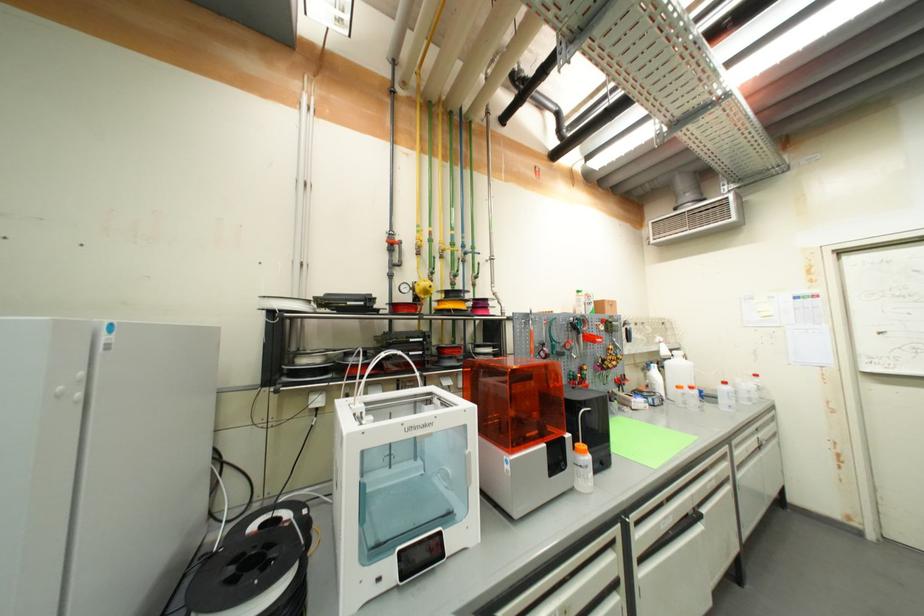
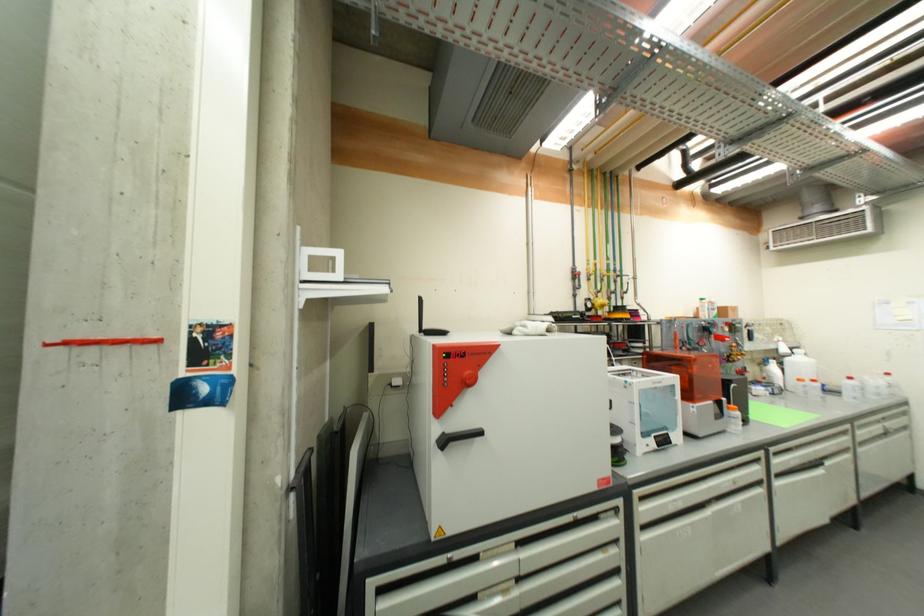
Locate, in the second image, the point that corresponds to [743,464] in the first image.

(864, 442)